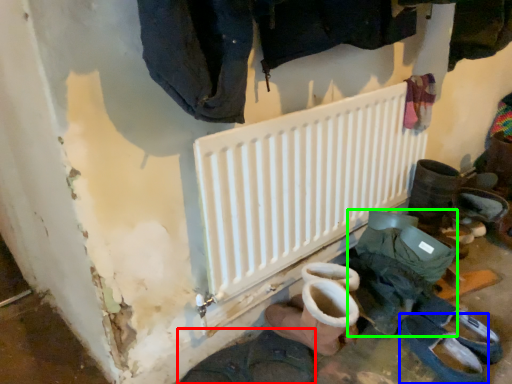
Question: Based on their relative distances, which object is nearer to footwear (highlighted by a red box)? Choose from footwear (highlighted by a blue box) and footwear (highlighted by a green box).

Choices:
 (A) footwear
 (B) footwear

Answer: (B)